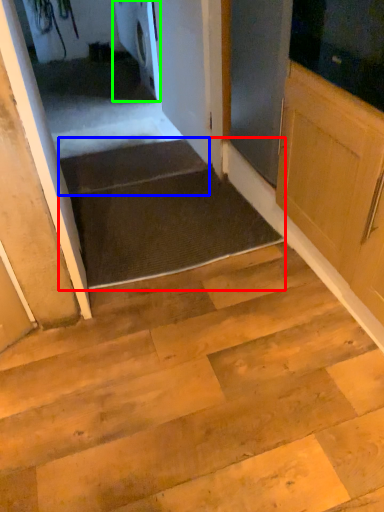
Question: Estimate the real-world distances between objects in this image. Which object is farther from stairwell (highlighted by a red box), stairs (highlighted by a blue box) or appliance (highlighted by a green box)?

Choices:
 (A) stairs
 (B) appliance

Answer: (B)